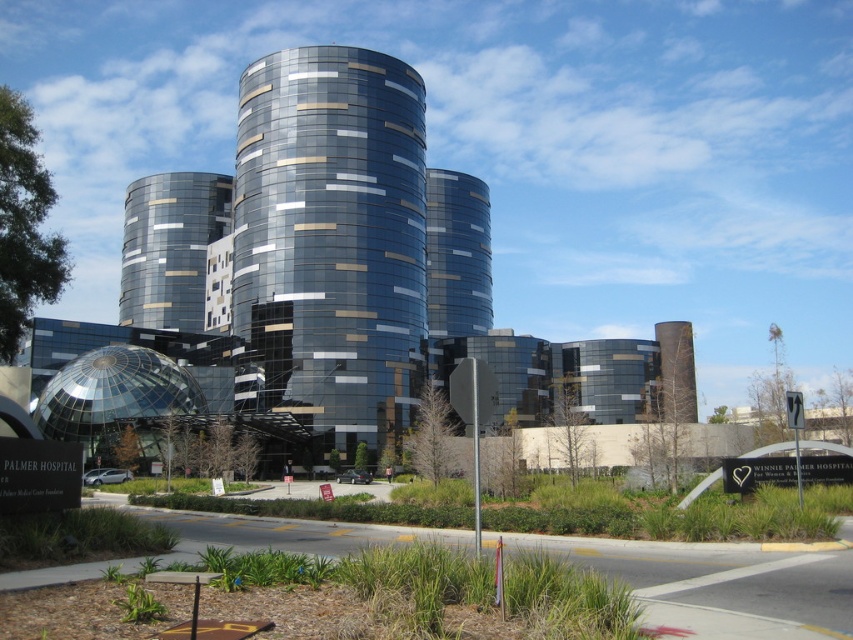
Can you confirm if glossy glass tower at center is wider than metallic glass building at center?

No, glossy glass tower at center is not wider than metallic glass building at center.

Is point (386, 406) positioned behind point (194, 314)?

No, (386, 406) is closer to viewer.

Where is `glossy glass tower at center`? This screenshot has width=853, height=640. glossy glass tower at center is located at coordinates (329, 243).